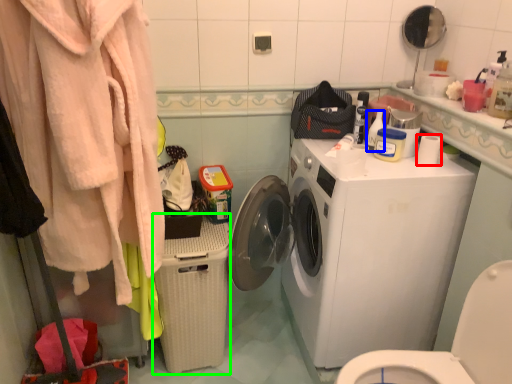
Question: Considering the real-world distances, which object is farthest from toilet paper (highlighted by a red box)? cleaning product (highlighted by a blue box) or dish washer (highlighted by a green box)?

Choices:
 (A) cleaning product
 (B) dish washer

Answer: (B)